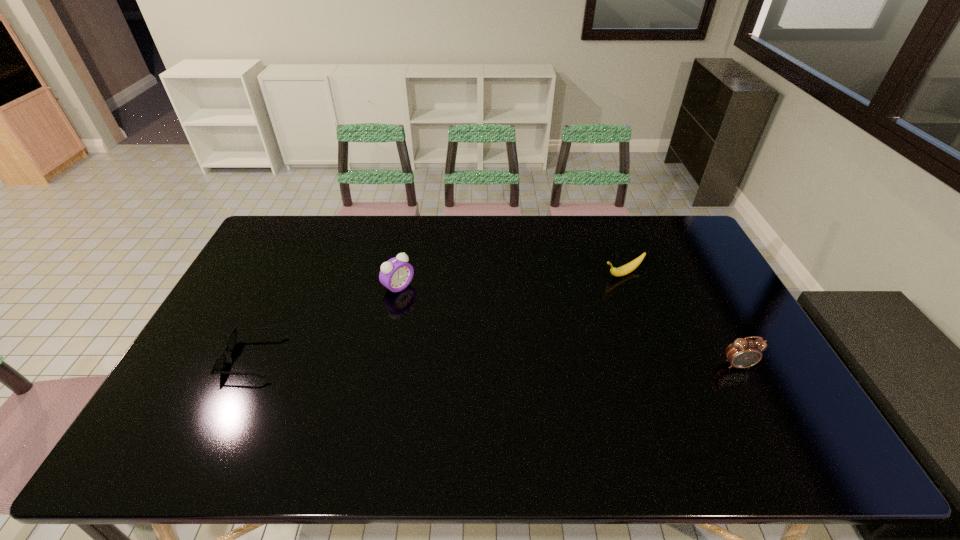
What are the coordinates of `the leftmost object` in the screenshot? It's located at (219, 364).

The image size is (960, 540). I want to click on sunglasses, so click(x=219, y=364).

This screenshot has height=540, width=960. I want to click on the rightmost object, so click(743, 353).

At what (x,y) coordinates should I click in order to perform the action: click on the nearer alarm clock. Please return your answer as a coordinate pair (x, y). The image size is (960, 540). Looking at the image, I should click on (743, 353).

Locate an element on the screen. the second shortest object is located at coordinates (629, 267).

Image resolution: width=960 pixels, height=540 pixels. I want to click on banana, so click(x=629, y=267).

Identify the location of the farther alarm clock. The image size is (960, 540). (396, 274).

This screenshot has width=960, height=540. I want to click on the second object from left to right, so click(x=396, y=274).

In order to click on blank space located 0.070m on the front-facing side of the leftmost object in this screenshot , I will do `click(203, 357)`.

The width and height of the screenshot is (960, 540). What are the coordinates of `free spot located 0.120m on the face of the right alarm clock` in the screenshot? It's located at (761, 410).